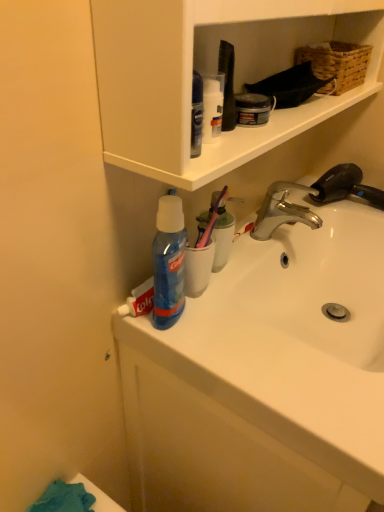
Question: In terms of size, does white glossy sink at center, the 2th sink from the bottom, appear bigger or smaller than silver metallic faucet at upper right?

Choices:
 (A) small
 (B) big

Answer: (B)

Question: Based on their positions, is white glossy sink at center, the 2th sink from the bottom, located to the left or right of silver metallic faucet at upper right?

Choices:
 (A) right
 (B) left

Answer: (B)

Question: Which is nearer to the white glossy sink at center, placed as the 1th sink when sorted from top to bottom?

Choices:
 (A) white glossy sink at center, arranged as the 2th sink when viewed from the top
 (B) chrome metallic faucet at upper right
 (C) woven brown basket at upper right
 (D) silver metallic faucet at upper right

Answer: (A)

Question: Which is nearer to the chrome metallic faucet at upper right?

Choices:
 (A) white glossy sink at center, placed as the 1th sink when sorted from top to bottom
 (B) white glossy sink at center, arranged as the 2th sink when viewed from the top
 (C) silver metallic faucet at upper right
 (D) woven brown basket at upper right

Answer: (C)